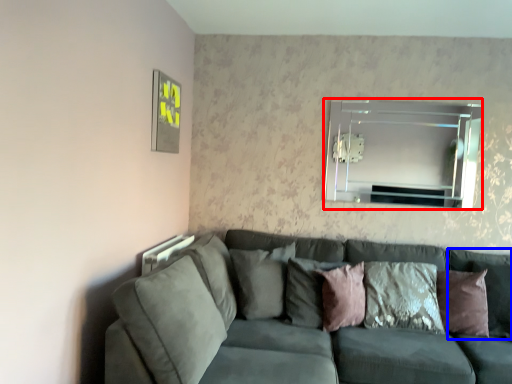
Question: Among these objects, which one is nearest to the camera, mirror (highlighted by a red box) or pillow (highlighted by a blue box)?

Choices:
 (A) mirror
 (B) pillow

Answer: (B)